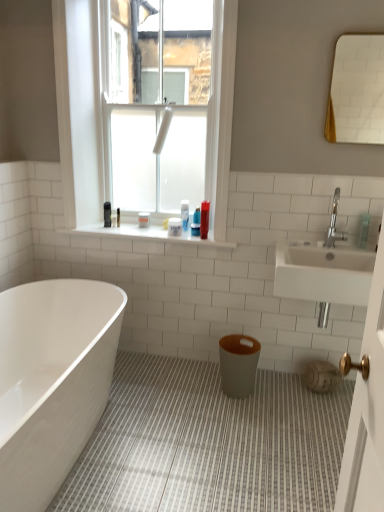
Question: Would you say white glossy mirror at upper right contains translucent plastic bottle at upper center, the second toiletry viewed from the back?

Choices:
 (A) no
 (B) yes

Answer: (A)

Question: From a real-world perspective, is white glossy mirror at upper right located beneath translucent plastic bottle at upper center, the second toiletry viewed from the back?

Choices:
 (A) yes
 (B) no

Answer: (B)

Question: From the image's perspective, is white glossy mirror at upper right located beneath translucent plastic bottle at upper center, placed as the fourth toiletry when sorted from front to back?

Choices:
 (A) yes
 (B) no

Answer: (B)

Question: Is white glossy mirror at upper right with translucent plastic bottle at upper center, placed as the fourth toiletry when sorted from front to back?

Choices:
 (A) yes
 (B) no

Answer: (B)

Question: Considering the relative sizes of white glossy mirror at upper right and translucent plastic bottle at upper center, which appears as the 3th toiletry when viewed from the right, in the image provided, is white glossy mirror at upper right bigger than translucent plastic bottle at upper center, which appears as the 3th toiletry when viewed from the right,?

Choices:
 (A) no
 (B) yes

Answer: (B)

Question: From the image's perspective, is white tile at upper center positioned above or below translucent plastic bottle at upper center, the second toiletry viewed from the back?

Choices:
 (A) below
 (B) above

Answer: (A)

Question: Is white tile at upper center inside or outside of translucent plastic bottle at upper center, which appears as the 3th toiletry when viewed from the right?

Choices:
 (A) outside
 (B) inside

Answer: (A)

Question: Relative to translucent plastic bottle at upper center, the second toiletry viewed from the back, is white tile at upper center in front or behind?

Choices:
 (A) front
 (B) behind

Answer: (A)

Question: From a real-world perspective, is white tile at upper center positioned above or below translucent plastic bottle at upper center, acting as the third toiletry starting from the left?

Choices:
 (A) below
 (B) above

Answer: (A)

Question: In terms of width, does white glossy bathtub at lower left look wider or thinner when compared to translucent plastic bottle at upper center, acting as the third toiletry starting from the left?

Choices:
 (A) thin
 (B) wide

Answer: (B)

Question: Based on their sizes in the image, would you say white glossy bathtub at lower left is bigger or smaller than translucent plastic bottle at upper center, acting as the third toiletry starting from the left?

Choices:
 (A) small
 (B) big

Answer: (B)

Question: From the image's perspective, is white glossy bathtub at lower left positioned above or below translucent plastic bottle at upper center, acting as the third toiletry starting from the left?

Choices:
 (A) above
 (B) below

Answer: (B)

Question: In the image, is white glossy bathtub at lower left positioned in front of or behind translucent plastic bottle at upper center, which appears as the 3th toiletry when viewed from the right?

Choices:
 (A) front
 (B) behind

Answer: (A)

Question: From the image's perspective, is silver metallic faucet at upper right located above or below translucent plastic bottle at upper center, which appears as the 3th toiletry when viewed from the right?

Choices:
 (A) below
 (B) above

Answer: (A)

Question: Considering the positions of silver metallic faucet at upper right and translucent plastic bottle at upper center, which appears as the 3th toiletry when viewed from the right, in the image, is silver metallic faucet at upper right wider or thinner than translucent plastic bottle at upper center, which appears as the 3th toiletry when viewed from the right,?

Choices:
 (A) thin
 (B) wide

Answer: (B)